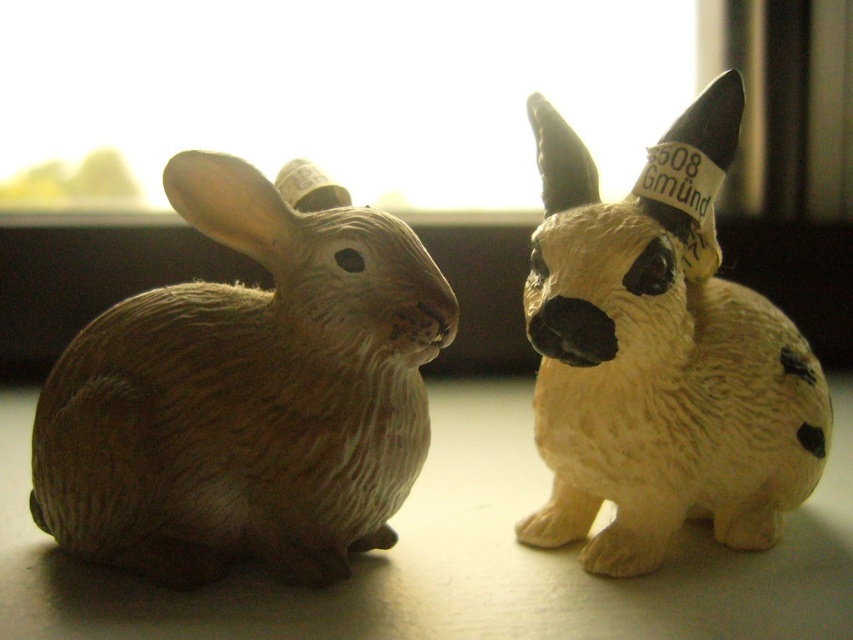
From the picture: You are looking at the two rabbits on the table. Which point, point 1 at coordinates [299,205] or point 2 at [576,150], is closer to you?

Point 1 at coordinates [299,205] is closer to you because it is further to the viewer than point 2 at [576,150].

You are arranging these two rabbits on a shelf and want to place a small vase between them. Since the matte brown rabbit at left is to the left of the matte beige rabbit at right, where should you position the vase to ensure it is between them?

The vase should be placed between the matte brown rabbit at left and the matte beige rabbit at right, positioned to the right of the matte brown rabbit at left and to the left of the matte beige rabbit at right.